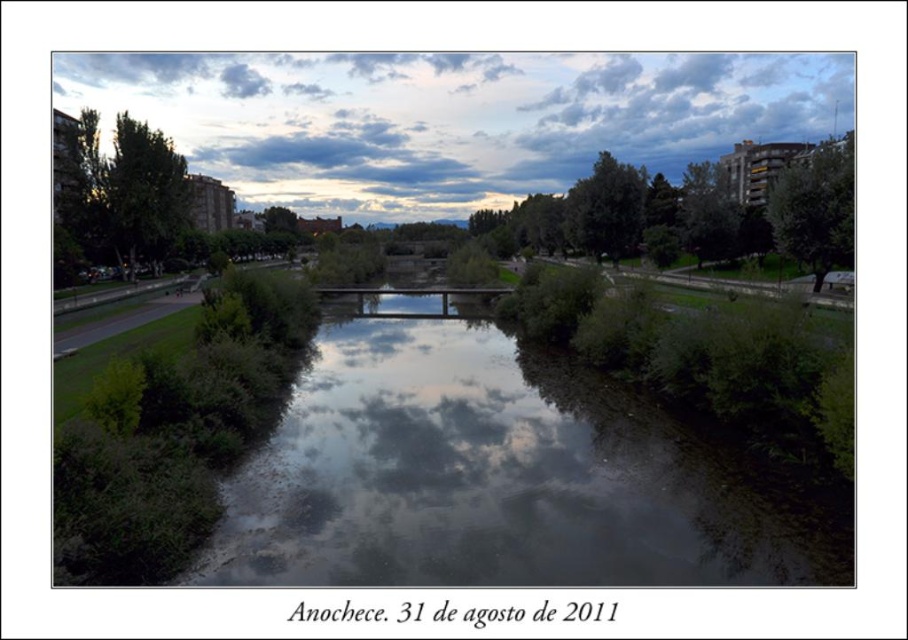
The height and width of the screenshot is (640, 908). Describe the element at coordinates (498, 477) in the screenshot. I see `green leafy river at center` at that location.

What are the coordinates of `green leafy river at center` in the screenshot? It's located at (498, 477).